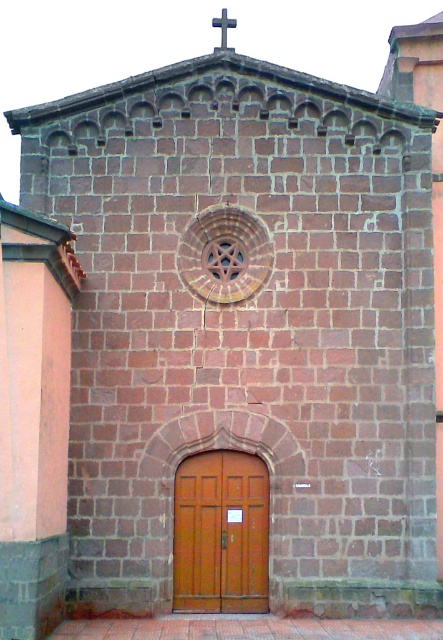
Question: From the image, what is the correct spatial relationship of wooden door at center in relation to white plastic cross at upper center?

Choices:
 (A) below
 (B) above

Answer: (A)

Question: Is wooden door at center closer to camera compared to white plastic cross at upper center?

Choices:
 (A) yes
 (B) no

Answer: (A)

Question: Does wooden door at center appear over white plastic cross at upper center?

Choices:
 (A) no
 (B) yes

Answer: (A)

Question: Which of the following is the closest to the observer?

Choices:
 (A) white plastic cross at upper center
 (B) wooden door at center

Answer: (B)